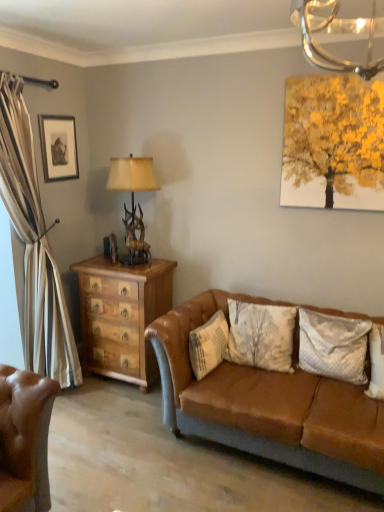
I want to click on velvety white pillow at center right, the 2th pillow when ordered from left to right, so click(x=333, y=346).

What do you see at coordinates (122, 316) in the screenshot? I see `wooden chest of drawers at left` at bounding box center [122, 316].

What do you see at coordinates (268, 405) in the screenshot? This screenshot has height=512, width=384. I see `brown leather couch at center` at bounding box center [268, 405].

Find the location of a particular element. white textured pillow at center, which is the second pillow in right-to-left order is located at coordinates (208, 345).

What do you see at coordinates (208, 345) in the screenshot? This screenshot has width=384, height=512. I see `white textured pillow at center, which is the second pillow in right-to-left order` at bounding box center [208, 345].

Locate an element on the screen. This screenshot has height=512, width=384. velvety white pillow at center right, the 1th pillow viewed from the right is located at coordinates (333, 346).

Is antler-patterned wood table lamp at left oriented away from white textured pillow at center, which is the second pillow in right-to-left order?

No, antler-patterned wood table lamp at left is not facing away from white textured pillow at center, which is the second pillow in right-to-left order.

From the image's perspective, is antler-patterned wood table lamp at left on top of white textured pillow at center, which is the second pillow in right-to-left order?

Yes, from the image's perspective, antler-patterned wood table lamp at left is above white textured pillow at center, which is the second pillow in right-to-left order.

Considering the relative sizes of antler-patterned wood table lamp at left and white textured pillow at center, which appears as the 1th pillow when viewed from the left, in the image provided, is antler-patterned wood table lamp at left shorter than white textured pillow at center, which appears as the 1th pillow when viewed from the left,?

In fact, antler-patterned wood table lamp at left may be taller than white textured pillow at center, which appears as the 1th pillow when viewed from the left.

Is antler-patterned wood table lamp at left positioned in front of white textured pillow at center, which appears as the 1th pillow when viewed from the left?

No, antler-patterned wood table lamp at left is behind white textured pillow at center, which appears as the 1th pillow when viewed from the left.

From a real-world perspective, is brown leather couch at center physically below wooden chest of drawers at left?

Yes, from a real-world perspective, brown leather couch at center is under wooden chest of drawers at left.

In terms of height, does brown leather couch at center look taller or shorter compared to wooden chest of drawers at left?

Clearly, brown leather couch at center is shorter compared to wooden chest of drawers at left.

Is brown leather couch at center not near wooden chest of drawers at left?

No, brown leather couch at center is in close proximity to wooden chest of drawers at left.

How much distance is there between brown leather couch at center and wooden chest of drawers at left?

A distance of 31.27 inches exists between brown leather couch at center and wooden chest of drawers at left.

Is wooden chest of drawers at left not within antler-patterned wood table lamp at left?

wooden chest of drawers at left lies outside antler-patterned wood table lamp at left's area.

Does wooden chest of drawers at left have a larger size compared to antler-patterned wood table lamp at left?

Yes, wooden chest of drawers at left is bigger than antler-patterned wood table lamp at left.

How many degrees apart are the facing directions of wooden chest of drawers at left and antler-patterned wood table lamp at left?

The angle between the facing direction of wooden chest of drawers at left and the facing direction of antler-patterned wood table lamp at left is 0.562 degrees.

From a real-world perspective, which is physically above, wooden chest of drawers at left or antler-patterned wood table lamp at left?

antler-patterned wood table lamp at left.

From a real-world perspective, is matte black frame at upper left below velvety white pillow at center right, the 2th pillow when ordered from left to right?

Incorrect, from a real-world perspective, matte black frame at upper left is higher than velvety white pillow at center right, the 2th pillow when ordered from left to right.

Does matte black frame at upper left have a larger size compared to velvety white pillow at center right, the 2th pillow when ordered from left to right?

Actually, matte black frame at upper left might be smaller than velvety white pillow at center right, the 2th pillow when ordered from left to right.

Is point (42, 133) behind point (335, 318)?

Yes, it is behind point (335, 318).

In the scene shown: Can you tell me how much matte black frame at upper left and velvety white pillow at center right, the 1th pillow viewed from the right, differ in facing direction?

91.8 degrees.

Between brown leather couch at center and antler-patterned wood table lamp at left, which one has larger width?

With larger width is brown leather couch at center.

From a real-world perspective, who is located lower, brown leather couch at center or antler-patterned wood table lamp at left?

brown leather couch at center, from a real-world perspective.

Is brown leather couch at center oriented away from antler-patterned wood table lamp at left?

No, brown leather couch at center is not facing the opposite direction of antler-patterned wood table lamp at left.

Looking at this image, is velvety white pillow at center right, the 2th pillow when ordered from left to right, facing away from matte black frame at upper left?

No, matte black frame at upper left is not at the back of velvety white pillow at center right, the 2th pillow when ordered from left to right.

Is the surface of velvety white pillow at center right, the 1th pillow viewed from the right, in direct contact with matte black frame at upper left?

No, velvety white pillow at center right, the 1th pillow viewed from the right, is not making contact with matte black frame at upper left.

How many degrees apart are the facing directions of velvety white pillow at center right, the 2th pillow when ordered from left to right, and matte black frame at upper left?

The angular difference between velvety white pillow at center right, the 2th pillow when ordered from left to right, and matte black frame at upper left is 91.8 degrees.

Is velvety white pillow at center right, the 2th pillow when ordered from left to right, bigger or smaller than matte black frame at upper left?

velvety white pillow at center right, the 2th pillow when ordered from left to right, is bigger than matte black frame at upper left.

Does point (206, 341) come in front of point (142, 182)?

Yes.

In terms of size, does white textured pillow at center, which is the second pillow in right-to-left order, appear bigger or smaller than antler-patterned wood table lamp at left?

Clearly, white textured pillow at center, which is the second pillow in right-to-left order, is smaller in size than antler-patterned wood table lamp at left.

Is antler-patterned wood table lamp at left located within white textured pillow at center, which is the second pillow in right-to-left order?

No, antler-patterned wood table lamp at left is not a part of white textured pillow at center, which is the second pillow in right-to-left order.

Considering the relative positions of white textured pillow at center, which is the second pillow in right-to-left order, and antler-patterned wood table lamp at left in the image provided, is white textured pillow at center, which is the second pillow in right-to-left order, to the left of antler-patterned wood table lamp at left from the viewer's perspective?

No, white textured pillow at center, which is the second pillow in right-to-left order, is not to the left of antler-patterned wood table lamp at left.

In the image, there is a white textured pillow at center, which appears as the 1th pillow when viewed from the left. Where is `table lamp above it (from the image's perspective)`? This screenshot has width=384, height=512. table lamp above it (from the image's perspective) is located at coordinates (133, 202).

This screenshot has width=384, height=512. What are the coordinates of `studio couch on the right of the wooden chest of drawers at left` in the screenshot? It's located at (268, 405).

From the image, which object appears to be farther from velvety white pillow at center right, the 1th pillow viewed from the right, antler-patterned wood table lamp at left or white textured pillow at center, which appears as the 1th pillow when viewed from the left?

antler-patterned wood table lamp at left.

From the image, which object appears to be nearer to wooden chest of drawers at left, antler-patterned wood table lamp at left or matte black frame at upper left?

antler-patterned wood table lamp at left is closer to wooden chest of drawers at left.

Looking at this image, considering their positions, is antler-patterned wood table lamp at left positioned closer to wooden chest of drawers at left than white textured pillow at center, which is the second pillow in right-to-left order?

Among the two, antler-patterned wood table lamp at left is located nearer to wooden chest of drawers at left.

In the scene shown: When comparing their distances from matte black frame at upper left, does antler-patterned wood table lamp at left or wooden chest of drawers at left seem closer?

antler-patterned wood table lamp at left is closer to matte black frame at upper left.

From the image, which object appears to be farther from antler-patterned wood table lamp at left, velvety white pillow at center right, the 1th pillow viewed from the right, or brown leather couch at center?

Among the two, velvety white pillow at center right, the 1th pillow viewed from the right, is located further to antler-patterned wood table lamp at left.

From the picture: From the image, which object appears to be nearer to white textured pillow at center, which appears as the 1th pillow when viewed from the left, velvety white pillow at center right, the 1th pillow viewed from the right, or matte black frame at upper left?

velvety white pillow at center right, the 1th pillow viewed from the right, lies closer to white textured pillow at center, which appears as the 1th pillow when viewed from the left, than the other object.

From the image, which object appears to be nearer to velvety white pillow at center right, the 1th pillow viewed from the right, wooden chest of drawers at left or antler-patterned wood table lamp at left?

The object closer to velvety white pillow at center right, the 1th pillow viewed from the right, is wooden chest of drawers at left.

Looking at the image, which one is located further to brown leather couch at center, wooden chest of drawers at left or white textured pillow at center, which is the second pillow in right-to-left order?

Based on the image, wooden chest of drawers at left appears to be further to brown leather couch at center.

Find the location of a particular element. the chest of drawers that lies between matte black frame at upper left and white textured pillow at center, which is the second pillow in right-to-left order, from top to bottom is located at coordinates (122, 316).

The height and width of the screenshot is (512, 384). Identify the location of table lamp between wooden chest of drawers at left and velvety white pillow at center right, the 1th pillow viewed from the right. tap(133, 202).

You are a GUI agent. You are given a task and a screenshot of the screen. Output one action in this format:
    pyautogui.click(x=<x>, y=<y>)
    Task: Click on the chest of drawers between antler-patterned wood table lamp at left and white textured pillow at center, which appears as the 1th pillow when viewed from the left, vertically
    
    Given the screenshot: What is the action you would take?
    pyautogui.click(x=122, y=316)

This screenshot has width=384, height=512. In order to click on the chest of drawers situated between matte black frame at upper left and velvety white pillow at center right, the 1th pillow viewed from the right, from left to right in this screenshot , I will do `click(122, 316)`.